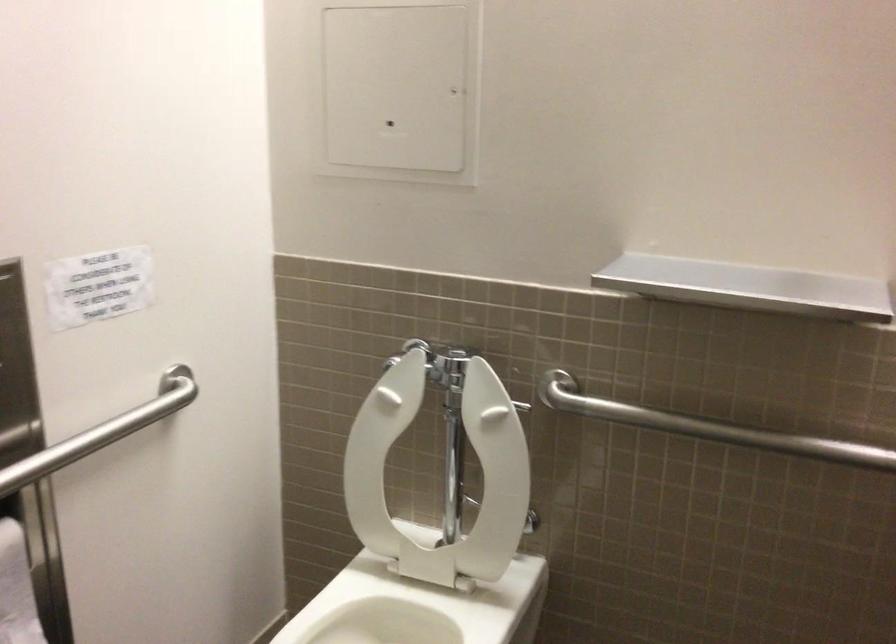
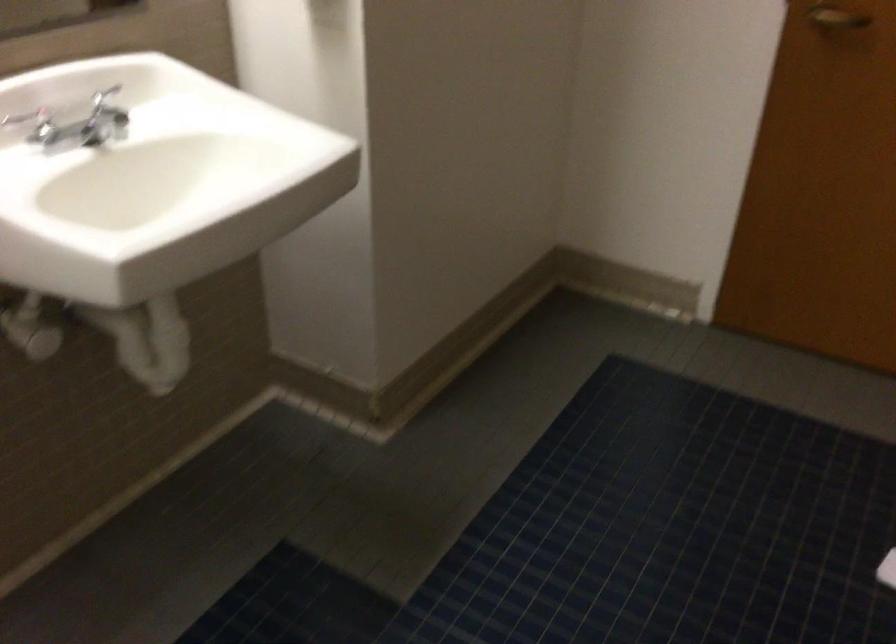
The images are taken continuously from a first-person perspective. In which direction is your viewpoint rotating?

The camera rotated toward right-down.